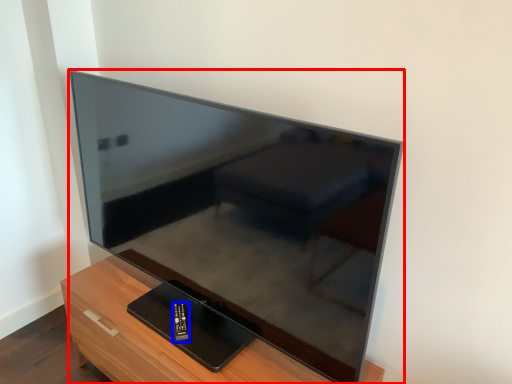
Question: Which point is further to the camera, television (highlighted by a red box) or control (highlighted by a blue box)?

Choices:
 (A) television
 (B) control

Answer: (B)